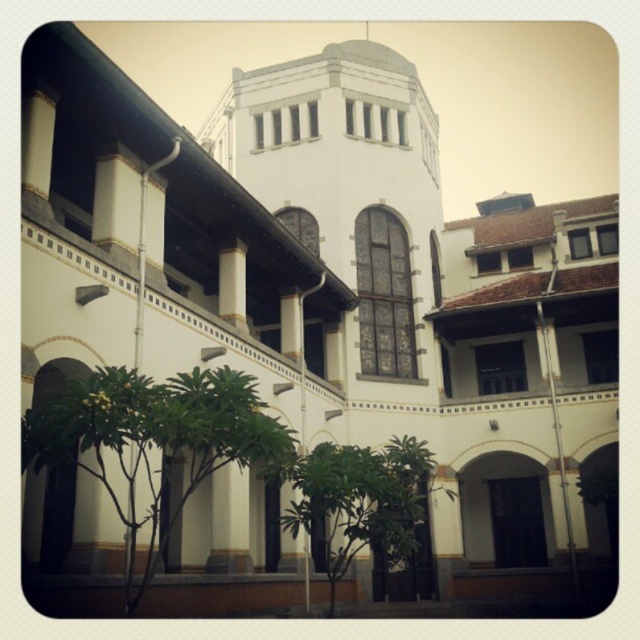
You are standing at the point marked as point (154, 440) in the image. What is the nearest object to you in the scene?

The nearest object to you is the green leafy tree at lower left because the point is located on it.